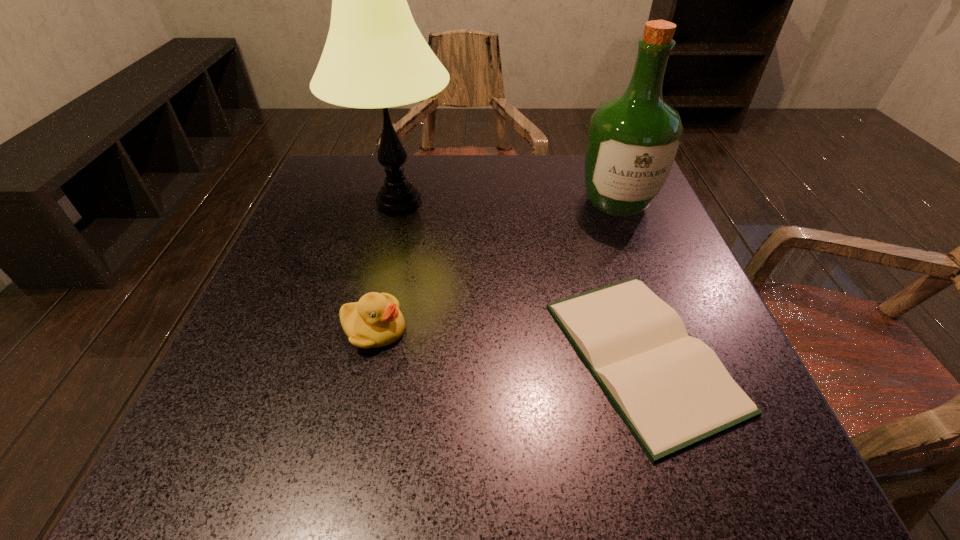
I want to click on lamp, so click(x=375, y=56).

Locate an element on the screen. The width and height of the screenshot is (960, 540). the second tallest object is located at coordinates (633, 140).

The width and height of the screenshot is (960, 540). Find the location of `duckling`. duckling is located at coordinates (374, 321).

I want to click on the shortest object, so click(671, 389).

Identify the location of vacant region located 0.110m on the front of the lamp. pos(382,275).

Find the location of `free space located 0.390m on the front-facing side of the third shortest object`. free space located 0.390m on the front-facing side of the third shortest object is located at coordinates pos(689,388).

Where is `vacant point located at the face of the second shortest object`? Image resolution: width=960 pixels, height=540 pixels. vacant point located at the face of the second shortest object is located at coordinates (454, 329).

Image resolution: width=960 pixels, height=540 pixels. Identify the location of vacant space located on the left of the shortest object. (407, 355).

You are a GUI agent. You are given a task and a screenshot of the screen. Output one action in this format:
    pyautogui.click(x=<x>, y=<y>)
    Task: Click on the lamp that is positioned at the far edge
    
    Given the screenshot: What is the action you would take?
    pyautogui.click(x=375, y=56)

What are the coordinates of `liquor at the far edge` in the screenshot? It's located at (633, 140).